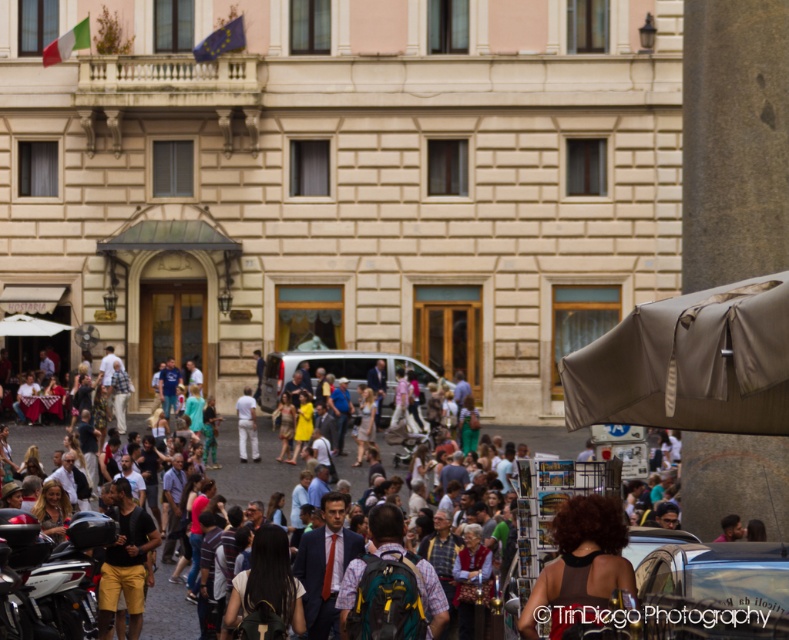
Which is more to the left, matte brown umbrella at center or dark brown curly hair at lower center?

From the viewer's perspective, dark brown curly hair at lower center appears more on the left side.

Between matte brown umbrella at center and dark brown curly hair at lower center, which one is positioned higher?

matte brown umbrella at center is above.

I want to click on matte brown umbrella at center, so click(x=690, y=364).

Locate an element on the screen. This screenshot has width=789, height=640. green fabric backpack at center is located at coordinates (386, 529).

Does yellow shorts at center appear on the left side of white cotton pants at center?

Indeed, yellow shorts at center is positioned on the left side of white cotton pants at center.

Which is in front, point (137, 552) or point (240, 420)?

Point (137, 552) is in front.

Is point (128, 627) positioned in front of point (251, 396)?

Yes, it is.

This screenshot has height=640, width=789. I want to click on yellow shorts at center, so click(x=125, y=561).